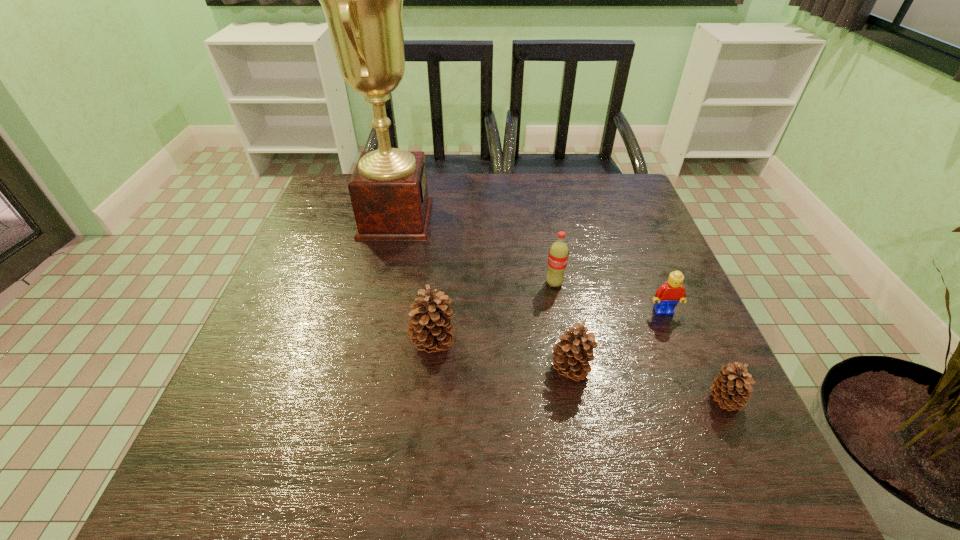
You are a GUI agent. You are given a task and a screenshot of the screen. Output one action in this format:
    pyautogui.click(x=<x>, y=<y>)
    Task: Click on the tallest pinecone
    The width and height of the screenshot is (960, 540).
    Given the screenshot: What is the action you would take?
    pyautogui.click(x=430, y=329)

In order to click on the second pinecone from right to left in this screenshot , I will do `click(571, 356)`.

Locate an element on the screen. The width and height of the screenshot is (960, 540). the rightmost pinecone is located at coordinates (731, 388).

Identify the location of the farthest object. This screenshot has height=540, width=960. (362, 0).

I want to click on trophy cup, so click(362, 0).

You are a GUI agent. You are given a task and a screenshot of the screen. Output one action in this format:
    pyautogui.click(x=<x>, y=<y>)
    Task: Click on the fourth nearest object
    
    Given the screenshot: What is the action you would take?
    pyautogui.click(x=667, y=296)

Identify the location of soda. (558, 253).

The width and height of the screenshot is (960, 540). Identify the location of vacant space situated on the right of the leftmost pinecone. (549, 344).

I want to click on free region located on the back of the second tallest pinecone, so click(x=562, y=322).

Locate an element on the screen. This screenshot has height=540, width=960. vacant space located on the left of the shortest pinecone is located at coordinates (504, 399).